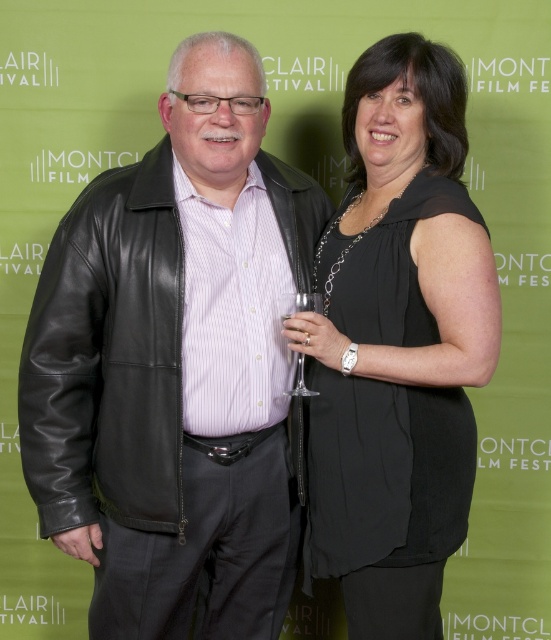
In the scene shown: You are standing in front of the CLAIR FESTIVAL backdrop and want to take a photo with both the black leather jacket at center and the black satin dress at center. Which one is closer to you so that you can focus on it first?

The black leather jacket at center is closer to you than the black satin dress at center, so you can focus on it first.

You are at the Clair Festival and want to take a photo of both the black leather jacket at center and the black satin dress at center. Which one should you focus on first if you want to capture them from left to right?

The black leather jacket at center is positioned on the left side of the black satin dress at center, so you should focus on the black leather jacket at center first to capture them from left to right.